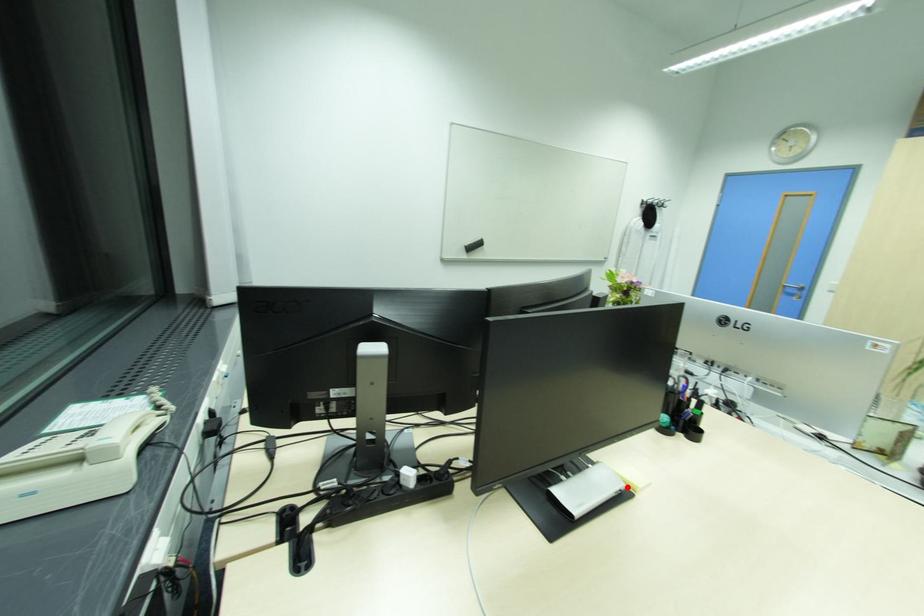
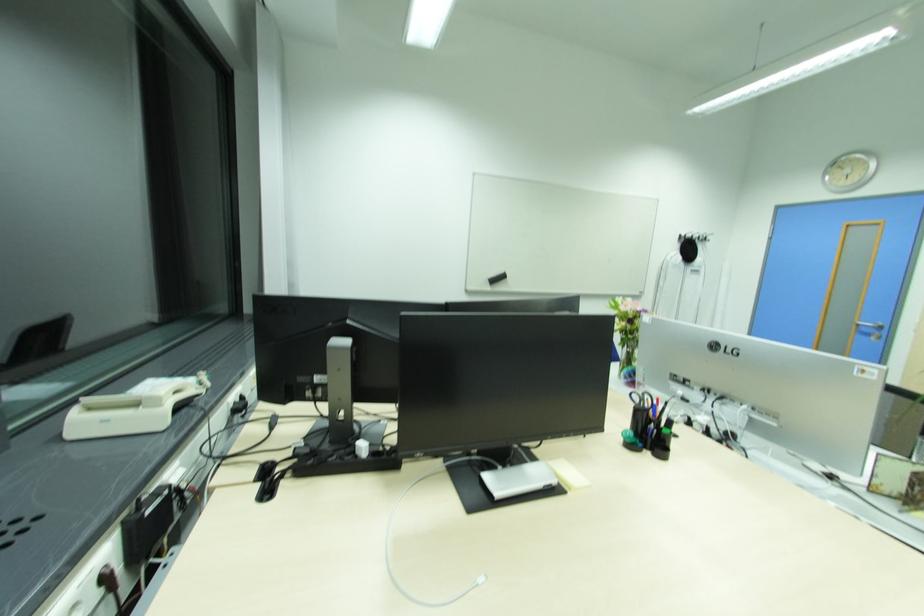
The point at the highlighted location is marked in the first image. Where is the corresponding point in the second image?

(560, 483)